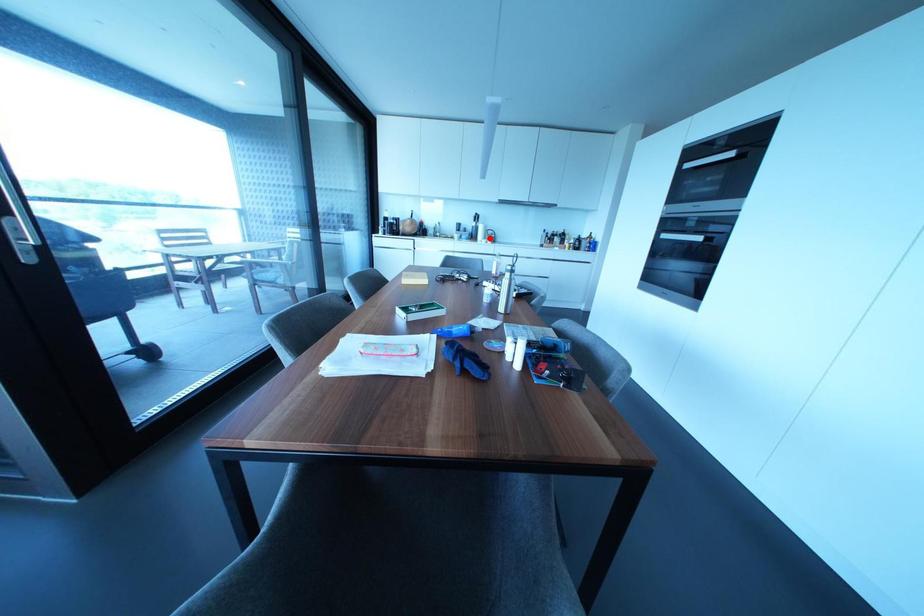
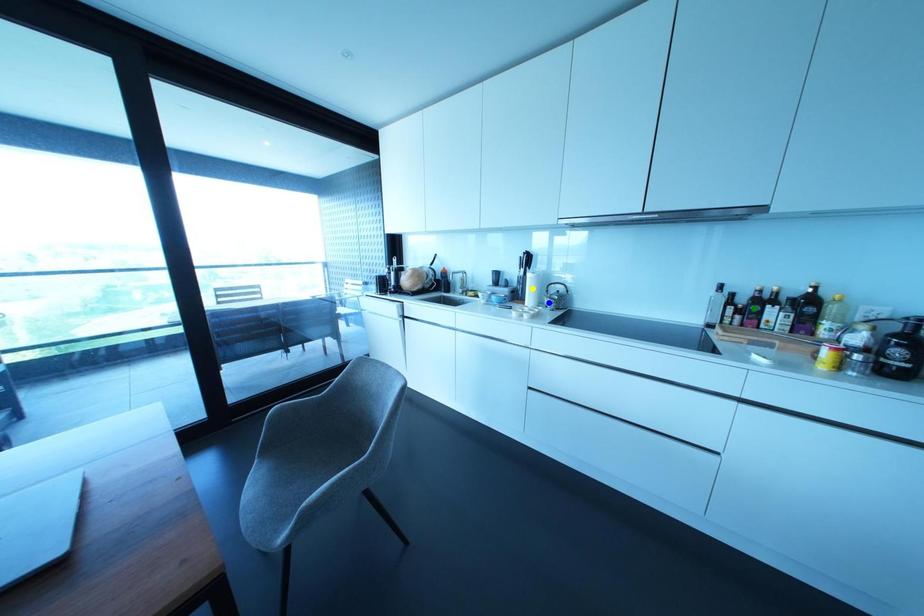
Question: I am providing you with two images of the same scene from different viewpoints. A red point is marked on the first image. You are given multiple points on the second image. Which mark in image 2 goes with the point in image 1?

Choices:
 (A) yellow point
 (B) blue point
 (C) green point

Answer: (B)